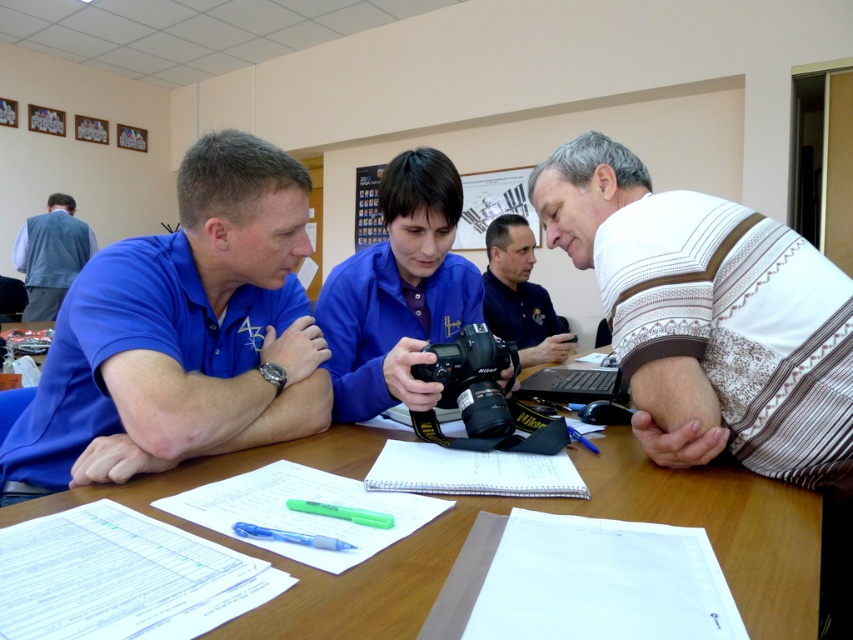
Is black plastic laptop at center positioned in front of green matte pen at lower center?

That is False.

Is point (612, 369) behind point (332, 508)?

Yes, it is.

You are a GUI agent. You are given a task and a screenshot of the screen. Output one action in this format:
    pyautogui.click(x=<x>, y=<y>)
    Task: Click on the black plastic laptop at center
    The height and width of the screenshot is (640, 853).
    Given the screenshot: What is the action you would take?
    pyautogui.click(x=573, y=385)

Between point (705, 218) and point (270, 536), which one is positioned behind?

Positioned behind is point (705, 218).

Does white striped sweater at right have a smaller size compared to translucent blue pen at lower left?

No.

Between point (714, 412) and point (299, 540), which one is positioned behind?

Point (714, 412)

You are a GUI agent. You are given a task and a screenshot of the screen. Output one action in this format:
    pyautogui.click(x=<x>, y=<y>)
    Task: Click on the white striped sweater at right
    
    Given the screenshot: What is the action you would take?
    pyautogui.click(x=709, y=316)

How far apart are light blue denim vest at upper left and black plastic laptop at center?

A distance of 3.83 meters exists between light blue denim vest at upper left and black plastic laptop at center.

This screenshot has width=853, height=640. In order to click on light blue denim vest at upper left in this screenshot , I will do `click(51, 256)`.